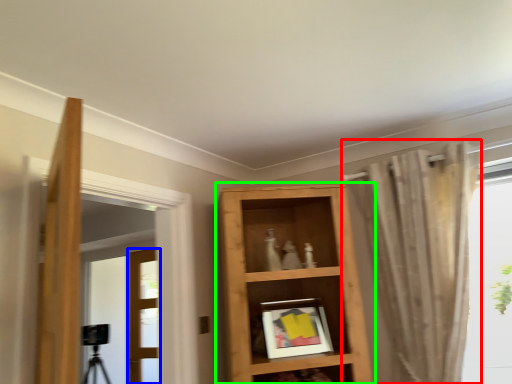
Question: Which is farther away from curtain (highlighted by a red box)? door (highlighted by a blue box) or shelf (highlighted by a green box)?

Choices:
 (A) door
 (B) shelf

Answer: (A)